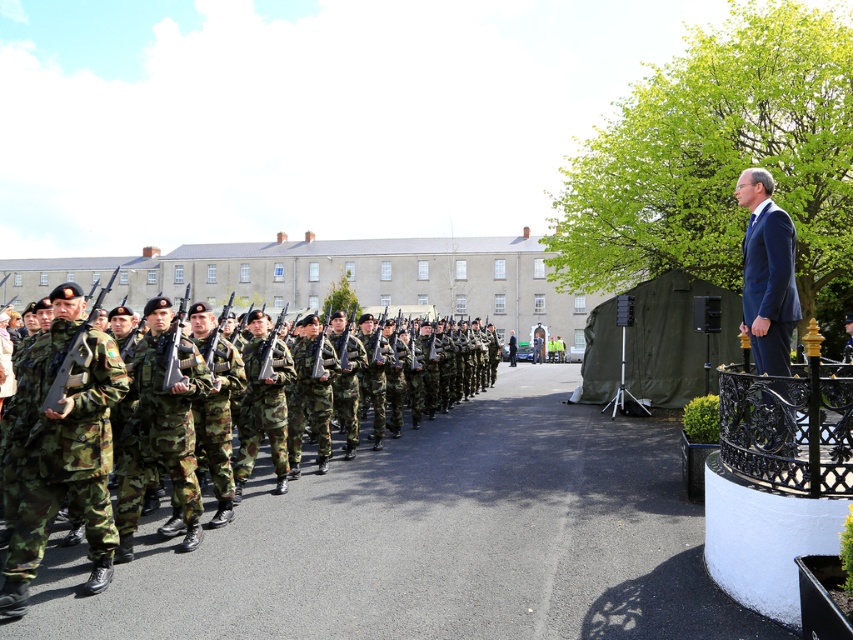
Is camouflage fabric soldiers at left positioned at the back of camouflage fabric uniform at left?

No, camouflage fabric soldiers at left is in front of camouflage fabric uniform at left.

Is camouflage fabric soldiers at left shorter than camouflage fabric uniform at left?

Yes.

Between point (161, 584) and point (100, 349), which one is positioned behind?

Positioned behind is point (161, 584).

The height and width of the screenshot is (640, 853). In order to click on camouflage fabric soldiers at left in this screenshot , I will do `click(329, 548)`.

The image size is (853, 640). I want to click on camouflage fabric uniform at left, so click(62, 451).

Does point (16, 388) come closer to viewer compared to point (744, 170)?

That is True.

Does point (96, 472) come farther from viewer compared to point (766, 204)?

No.

Where is `camouflage fabric uniform at left`? The width and height of the screenshot is (853, 640). camouflage fabric uniform at left is located at coordinates (62, 451).

Is camouflage fabric soldiers at left above dark blue suit at right?

Actually, camouflage fabric soldiers at left is below dark blue suit at right.

Image resolution: width=853 pixels, height=640 pixels. What do you see at coordinates (329, 548) in the screenshot?
I see `camouflage fabric soldiers at left` at bounding box center [329, 548].

Does point (495, 515) come farther from viewer compared to point (775, 250)?

Yes, it is behind point (775, 250).

Where is `camouflage fabric soldiers at left`? camouflage fabric soldiers at left is located at coordinates (329, 548).